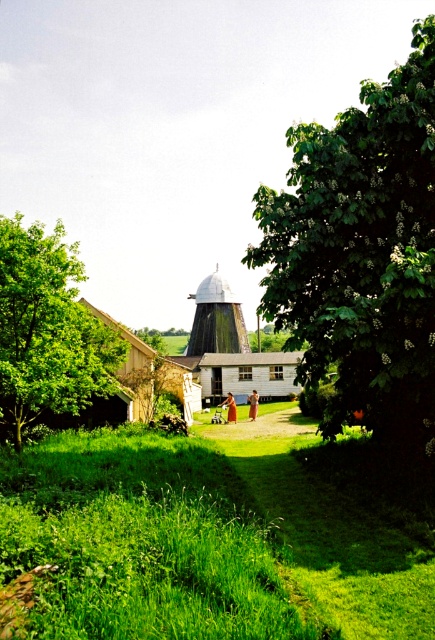
Question: Which object is positioned closest to the green grassy at center?

Choices:
 (A) green leafy tree at center right
 (B) white matte silo at center
 (C) green leafy tree at left

Answer: (A)

Question: Among these points, which one is farthest from the camera?

Choices:
 (A) (240, 508)
 (B) (217, 328)
 (C) (87, 388)
 (D) (358, 225)

Answer: (B)

Question: Which object is closer to the camera taking this photo?

Choices:
 (A) green leafy tree at center right
 (B) green leafy tree at left

Answer: (A)

Question: In this image, where is green grassy at center located relative to white matte silo at center?

Choices:
 (A) above
 (B) below

Answer: (B)

Question: Is green leafy tree at center right wider than green leafy tree at left?

Choices:
 (A) no
 (B) yes

Answer: (A)

Question: Can you confirm if green leafy tree at center right is smaller than green leafy tree at left?

Choices:
 (A) yes
 (B) no

Answer: (A)